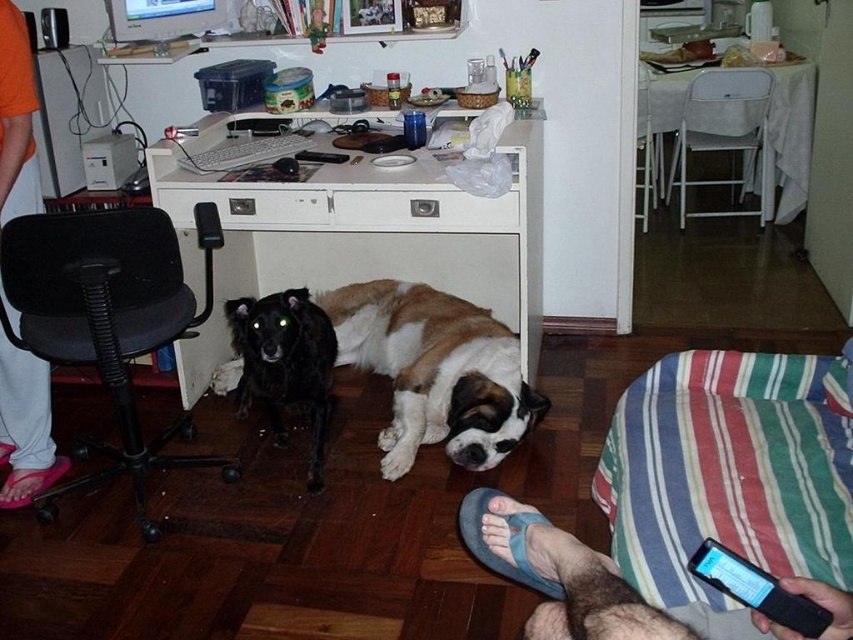
You are organizing a small party in this room and need to move the white plastic chair at upper right and the white plastic chair at upper center. Based on their positions, which chair would you move first to create space without disturbing the dogs?

The white plastic chair at upper right is below the white plastic chair at upper center. To create space without disturbing the dogs, you should move the white plastic chair at upper center first since it is above the other chair and might be blocking access to it.

You are standing in the room and want to reach the point marked at coordinates [711,573]. If your height is 160 centimeters, will the desk items block your path to that point?

The point at coordinates [711,573] is 72.74 centimeters away from you. Since the desk is cluttered with items like a keyboard, mouse, plastic container, and papers, these items might block your path depending on their arrangement. However, the distance is relatively short, so it is possible to navigate around them if they are not densely packed.